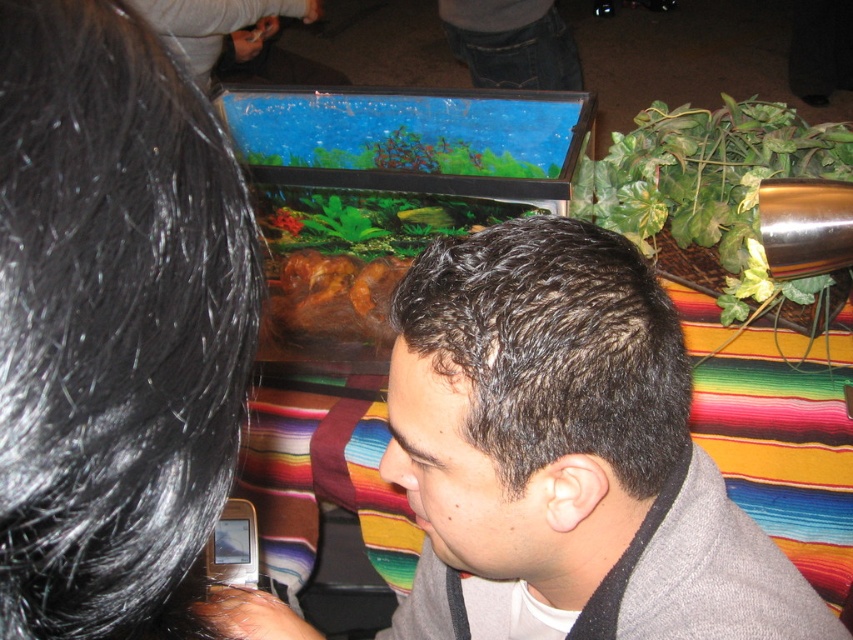
Question: Does dark gray fabric at center come in front of metallic silver phone at lower left?

Choices:
 (A) no
 (B) yes

Answer: (B)

Question: Is dark gray fabric at center thinner than metallic silver phone at lower left?

Choices:
 (A) yes
 (B) no

Answer: (B)

Question: Is dark gray fabric at center smaller than metallic silver phone at lower left?

Choices:
 (A) no
 (B) yes

Answer: (A)

Question: Which point appears closest to the camera in this image?

Choices:
 (A) (258, 552)
 (B) (463, 422)

Answer: (B)

Question: Which of the following is the farthest from the observer?

Choices:
 (A) (241, 554)
 (B) (511, 552)

Answer: (A)